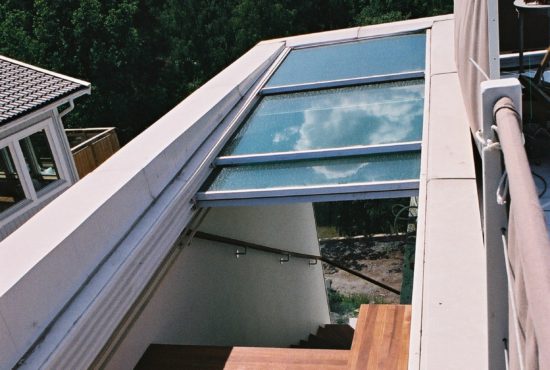
Identify the location of stairs. Image resolution: width=550 pixels, height=370 pixels. (334, 340).